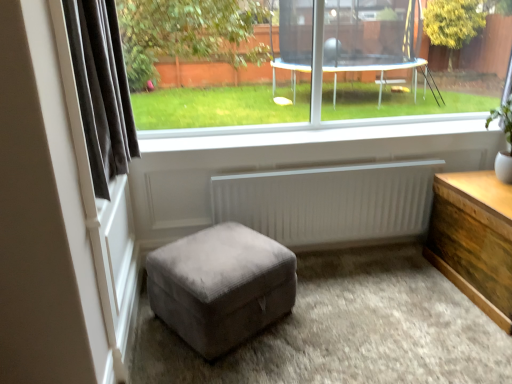
Question: From the image's perspective, is wooden chest at right located beneath white smooth window sill at center?

Choices:
 (A) yes
 (B) no

Answer: (A)

Question: Does wooden chest at right come in front of white smooth window sill at center?

Choices:
 (A) no
 (B) yes

Answer: (B)

Question: Does wooden chest at right appear on the right side of white smooth window sill at center?

Choices:
 (A) yes
 (B) no

Answer: (A)

Question: Does wooden chest at right have a greater width compared to white smooth window sill at center?

Choices:
 (A) no
 (B) yes

Answer: (B)

Question: Is wooden chest at right turned away from white smooth window sill at center?

Choices:
 (A) no
 (B) yes

Answer: (A)

Question: Visually, is wooden chest at right positioned to the left or to the right of dark grey fabric curtain at left?

Choices:
 (A) left
 (B) right

Answer: (B)

Question: From their relative heights in the image, would you say wooden chest at right is taller or shorter than dark grey fabric curtain at left?

Choices:
 (A) short
 (B) tall

Answer: (A)

Question: Is wooden chest at right situated inside dark grey fabric curtain at left or outside?

Choices:
 (A) inside
 (B) outside

Answer: (B)

Question: Based on their sizes in the image, would you say wooden chest at right is bigger or smaller than dark grey fabric curtain at left?

Choices:
 (A) big
 (B) small

Answer: (A)

Question: From the image's perspective, relative to white ribbed radiator at center, is wooden chest at right above or below?

Choices:
 (A) above
 (B) below

Answer: (B)

Question: Considering the positions of wooden chest at right and white ribbed radiator at center in the image, is wooden chest at right wider or thinner than white ribbed radiator at center?

Choices:
 (A) thin
 (B) wide

Answer: (B)

Question: Considering the positions of point (489, 289) and point (215, 183), is point (489, 289) closer or farther from the camera than point (215, 183)?

Choices:
 (A) farther
 (B) closer

Answer: (B)

Question: Is wooden chest at right taller or shorter than white ribbed radiator at center?

Choices:
 (A) tall
 (B) short

Answer: (A)

Question: In terms of height, does suede ottoman at center look taller or shorter compared to dark grey fabric curtain at left?

Choices:
 (A) tall
 (B) short

Answer: (B)

Question: Based on their sizes in the image, would you say suede ottoman at center is bigger or smaller than dark grey fabric curtain at left?

Choices:
 (A) big
 (B) small

Answer: (A)